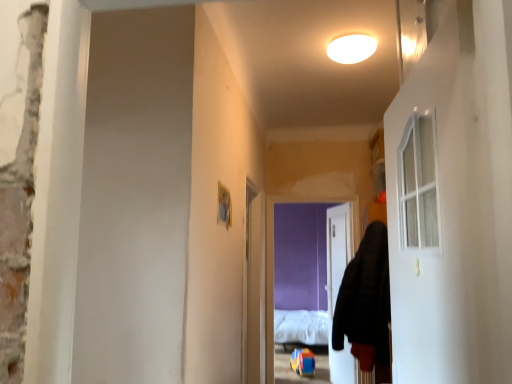
Locate an element on the screen. The width and height of the screenshot is (512, 384). white fluffy bed at center is located at coordinates (302, 327).

This screenshot has width=512, height=384. What do you see at coordinates (351, 48) in the screenshot? I see `white matte ceiling light at upper center` at bounding box center [351, 48].

At what (x,y) coordinates should I click in order to perform the action: click on white glass door at right, the second door when ordered from back to front. Please return your answer as a coordinate pair (x, y). This screenshot has height=384, width=512. Looking at the image, I should click on (434, 209).

Describe the element at coordinates (434, 209) in the screenshot. I see `white glass door at right, which appears as the second door when viewed from the right` at that location.

Describe the element at coordinates (365, 301) in the screenshot. This screenshot has width=512, height=384. I see `black fuzzy hoodie at right` at that location.

Image resolution: width=512 pixels, height=384 pixels. Describe the element at coordinates (253, 282) in the screenshot. I see `clear plastic screen door at center` at that location.

Identify the location of white fluffy bed at center. (302, 327).

Is white glossy door at center, the 1th door positioned from the right, further to camera compared to clear plastic screen door at center?

Yes, white glossy door at center, the 1th door positioned from the right, is behind clear plastic screen door at center.

Between point (333, 372) and point (250, 319), which one is positioned in front?

Positioned in front is point (250, 319).

Can we say white glossy door at center, arranged as the first door when viewed from the back, lies outside clear plastic screen door at center?

Yes, white glossy door at center, arranged as the first door when viewed from the back, is not within clear plastic screen door at center.

Does clear plastic screen door at center appear on the right side of white glossy door at center, arranged as the first door when viewed from the back?

No.

Considering the relative sizes of clear plastic screen door at center and white glossy door at center, the 2th door from the left, in the image provided, is clear plastic screen door at center taller than white glossy door at center, the 2th door from the left,?

No.

From the image's perspective, is clear plastic screen door at center above white glossy door at center, which is counted as the second door, starting from the front?

Yes, from the image's perspective, clear plastic screen door at center is on top of white glossy door at center, which is counted as the second door, starting from the front.

Which is behind, point (459, 216) or point (344, 54)?

The point (344, 54) is farther from the camera.

Is white glass door at right, the second door when ordered from back to front, looking in the opposite direction of white matte ceiling light at upper center?

No.

Would you say white glass door at right, the second door when ordered from back to front, is outside white matte ceiling light at upper center?

Yes, white glass door at right, the second door when ordered from back to front, is located beyond the bounds of white matte ceiling light at upper center.

Between white glossy door at center, arranged as the first door when viewed from the back, and white matte ceiling light at upper center, which one has smaller width?

Thinner between the two is white glossy door at center, arranged as the first door when viewed from the back.

Does point (332, 279) appear closer or farther from the camera than point (375, 42)?

Point (332, 279) appears to be farther away from the viewer than point (375, 42).

Between white glossy door at center, the 2th door from the left, and white matte ceiling light at upper center, which one appears on the left side from the viewer's perspective?

white matte ceiling light at upper center.

Looking at this image, from the image's perspective, would you say white glossy door at center, the 1th door positioned from the right, is positioned over white glass door at right, arranged as the 1th door when viewed from the left?

No, from the image's perspective, white glossy door at center, the 1th door positioned from the right, is not over white glass door at right, arranged as the 1th door when viewed from the left.

Is point (348, 380) behind point (415, 311)?

Yes.

Considering the relative positions of white glossy door at center, the 2th door from the left, and white glass door at right, arranged as the 1th door when viewed from the left, in the image provided, is white glossy door at center, the 2th door from the left, behind white glass door at right, arranged as the 1th door when viewed from the left,?

Yes, white glossy door at center, the 2th door from the left, is behind white glass door at right, arranged as the 1th door when viewed from the left.

From a real-world perspective, between white glossy door at center, the 1th door positioned from the right, and white glass door at right, arranged as the 1th door when viewed from the left, who is vertically lower?

In real-world perspective, white glossy door at center, the 1th door positioned from the right, is lower.

From a real-world perspective, is clear plastic screen door at center on white matte ceiling light at upper center?

No, from a real-world perspective, clear plastic screen door at center is not on top of white matte ceiling light at upper center.

Which is in front, point (245, 255) or point (350, 36)?

The point (350, 36) is more forward.

From the image's perspective, would you say clear plastic screen door at center is shown under white matte ceiling light at upper center?

Yes, from the image's perspective, clear plastic screen door at center is below white matte ceiling light at upper center.

Is point (357, 45) closer to viewer compared to point (364, 298)?

Yes, point (357, 45) is in front of point (364, 298).

Is white matte ceiling light at upper center oriented away from black fuzzy hoodie at right?

No, black fuzzy hoodie at right is not at the back of white matte ceiling light at upper center.

Is white matte ceiling light at upper center smaller than black fuzzy hoodie at right?

Indeed, white matte ceiling light at upper center has a smaller size compared to black fuzzy hoodie at right.

This screenshot has height=384, width=512. Identify the location of screen door in front of the white glossy door at center, which is counted as the second door, starting from the front. (253, 282).

This screenshot has width=512, height=384. In the image, there is a clear plastic screen door at center. What are the coordinates of `door below it (from the image's perspective)` in the screenshot? It's located at (337, 250).

When comparing their distances from black fuzzy hoodie at right, does white matte ceiling light at upper center or white fluffy bed at center seem closer?

The object closer to black fuzzy hoodie at right is white matte ceiling light at upper center.

When comparing their distances from clear plastic screen door at center, does white matte ceiling light at upper center or white fluffy bed at center seem further?

white fluffy bed at center is positioned further to the anchor clear plastic screen door at center.

Which object lies nearer to the anchor point clear plastic screen door at center, white glossy door at center, which is counted as the second door, starting from the front, or white glass door at right, the second door when ordered from back to front?

Based on the image, white glossy door at center, which is counted as the second door, starting from the front, appears to be nearer to clear plastic screen door at center.

In the scene shown: Which object lies nearer to the anchor point white matte ceiling light at upper center, white glossy door at center, arranged as the first door when viewed from the back, or white fluffy bed at center?

white glossy door at center, arranged as the first door when viewed from the back.

Estimate the real-world distances between objects in this image. Which object is closer to clear plastic screen door at center, white fluffy bed at center or white glass door at right, arranged as the 1th door when viewed from the left?

white fluffy bed at center is positioned closer to the anchor clear plastic screen door at center.

Estimate the real-world distances between objects in this image. Which object is further from white matte ceiling light at upper center, white glass door at right, arranged as the 1th door when viewed from the left, or white fluffy bed at center?

white fluffy bed at center is further to white matte ceiling light at upper center.

From the image, which object appears to be nearer to white glass door at right, the second door when ordered from back to front, white matte ceiling light at upper center or black fuzzy hoodie at right?

The object closer to white glass door at right, the second door when ordered from back to front, is black fuzzy hoodie at right.

In the scene shown: From the image, which object appears to be farther from white glass door at right, arranged as the 1th door when viewed from the left, white glossy door at center, the 1th door positioned from the right, or clear plastic screen door at center?

white glossy door at center, the 1th door positioned from the right, lies further to white glass door at right, arranged as the 1th door when viewed from the left, than the other object.

Find the location of a particular element. The height and width of the screenshot is (384, 512). door between white glass door at right, the second door when ordered from back to front, and white fluffy bed at center from front to back is located at coordinates (337, 250).

Locate an element on the screen. The width and height of the screenshot is (512, 384). hoodie between white glass door at right, which is the first door from front to back, and clear plastic screen door at center in the front-back direction is located at coordinates click(x=365, y=301).

Where is `light between white glass door at right, arranged as the 1th door when viewed from the left, and white fluffy bed at center in the front-back direction`? The image size is (512, 384). light between white glass door at right, arranged as the 1th door when viewed from the left, and white fluffy bed at center in the front-back direction is located at coordinates (351, 48).

You are a GUI agent. You are given a task and a screenshot of the screen. Output one action in this format:
    pyautogui.click(x=<x>, y=<y>)
    Task: Click on the hoodie between white matte ceiling light at upper center and clear plastic screen door at center in the up-down direction
    This screenshot has width=512, height=384.
    Given the screenshot: What is the action you would take?
    pyautogui.click(x=365, y=301)